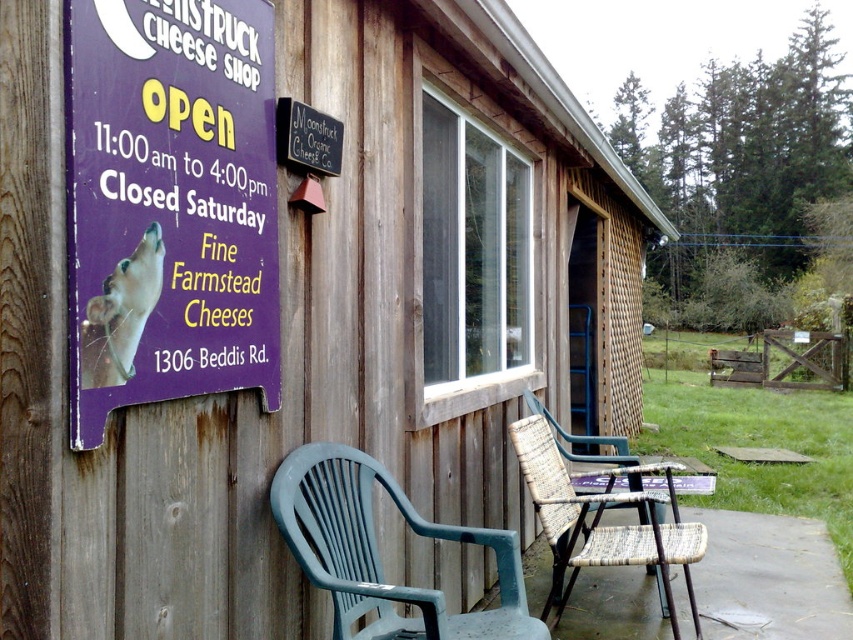
You are standing in front of the Moonstruck Cheese Shop and want to sit down while waiting. There is a purple wood sign at left and a green plastic chair at lower center. Which object should you approach to sit?

The green plastic chair at lower center is the object you should approach to sit, as it is a chair, while the purple wood sign at left is a signboard and not meant for sitting.

You are a customer approaching the Moonstruck Cheese Shop. You see a woven brown chair at lower center and a white fur dog at left. Which object is closer to you as you face the building?

The white fur dog at left is behind the woven brown chair at lower center, so the woven brown chair at lower center is closer to you as you face the building.

You are a customer who wants to sit and enjoy cheese samples. You see the purple wood sign at left and the green plastic chair at lower center. Which object is larger in size?

The green plastic chair at lower center is larger in size than the purple wood sign at left because the purple wood sign at left occupies less space than green plastic chair at lower center.